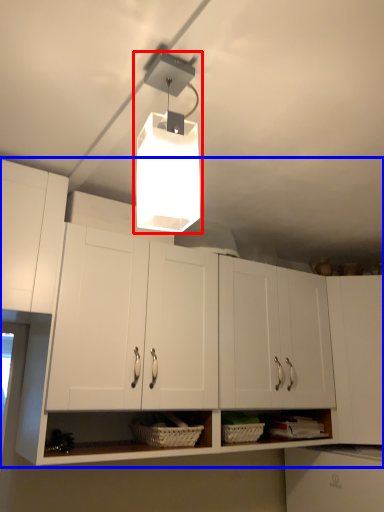
Question: Which point is further to the camera, lamp (highlighted by a red box) or cabinetry (highlighted by a blue box)?

Choices:
 (A) lamp
 (B) cabinetry

Answer: (B)